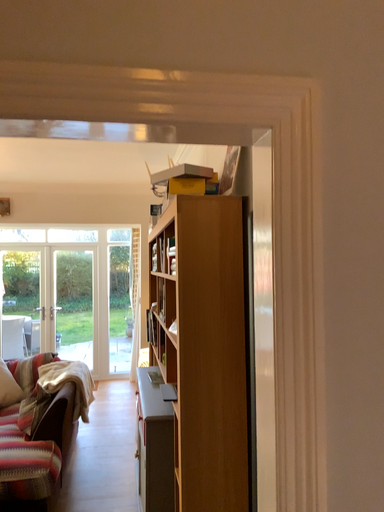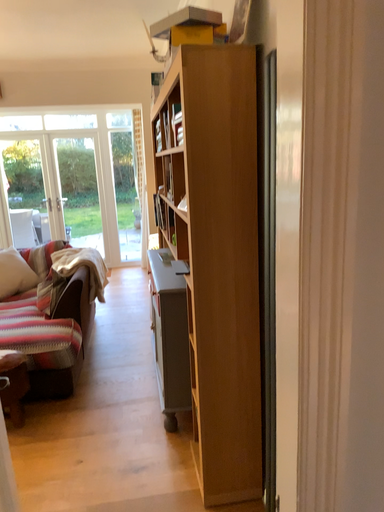
Question: How did the camera likely rotate when shooting the video?

Choices:
 (A) rotated downward
 (B) rotated upward

Answer: (A)